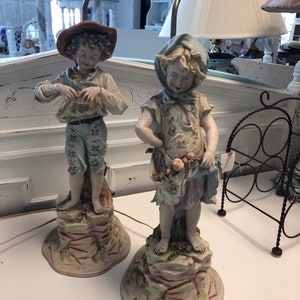
You are a GUI agent. You are given a task and a screenshot of the screen. Output one action in this format:
    pyautogui.click(x=<x>, y=<y>)
    Task: Click on the cord
    
    Given the screenshot: What is the action you would take?
    pyautogui.click(x=135, y=220), pyautogui.click(x=15, y=237), pyautogui.click(x=17, y=214)